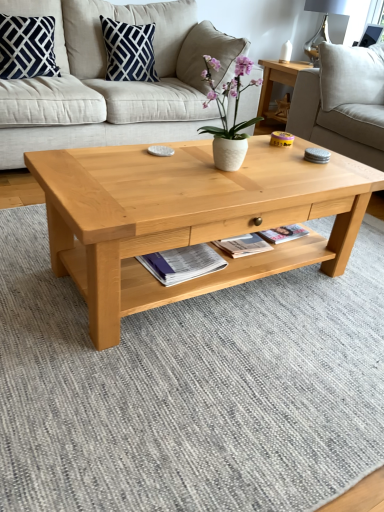
Where is `free space on the front side of white ceramic vase at center`? The image size is (384, 512). free space on the front side of white ceramic vase at center is located at coordinates coord(215,189).